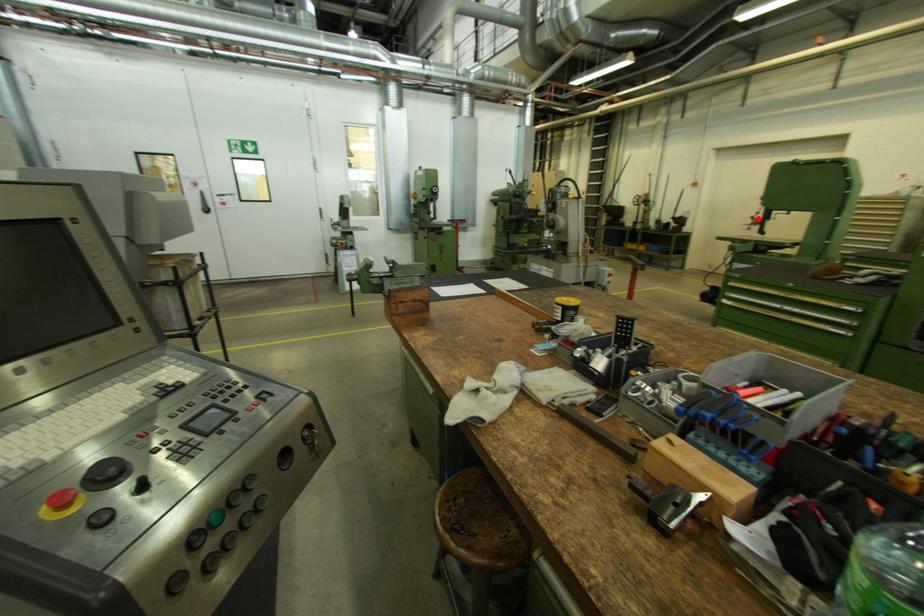
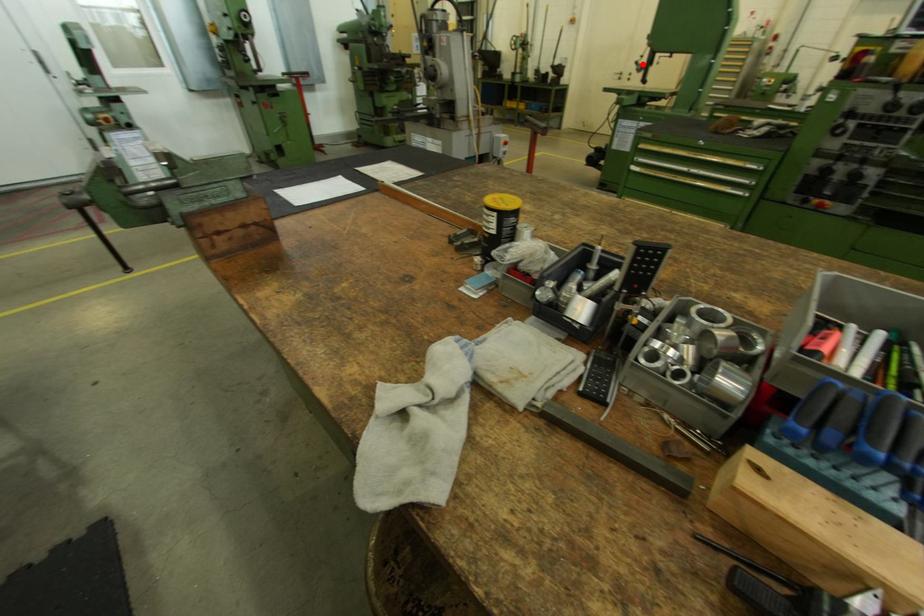
I am providing you with two images of the same scene from different viewpoints. A red point is marked on the first image and another point is marked on the second image. Do the highlighted points in image1 and image2 indicate the same real-world spot?

Yes